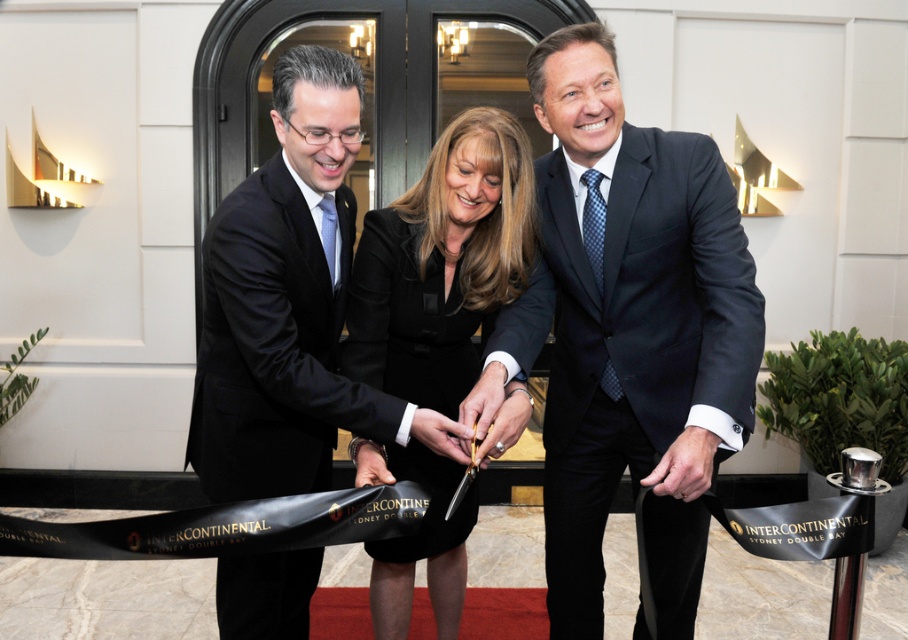
You are a photographer at the event and need to capture a clear photo of both the black satin dress at center and the black satin suit at center. Which one should you focus on first if you want to ensure both are in frame without moving the camera?

The black satin dress at center is positioned on the right side of the black satin suit at center, so you should focus on the black satin suit at center first to ensure both are in frame without moving the camera.

You are a photographer at the event and want to capture a photo of the woman in the black silk dress at center and the man in the black satin suit at center. Based on their positions, which one is positioned to the right side of the other?

The black silk dress at center is to the right of the black satin suit at center, so the woman in the black silk dress at center is positioned to the right of the man in the black satin suit at center.